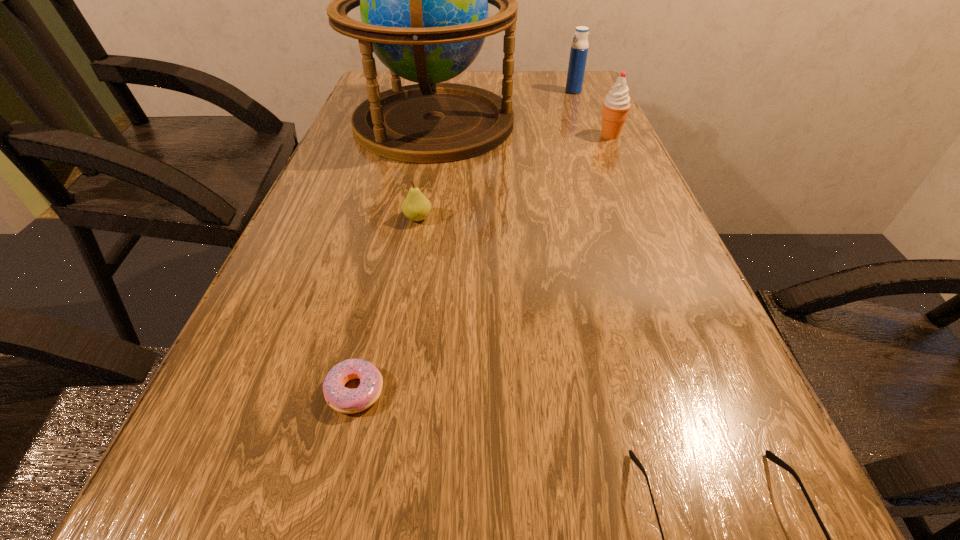
Locate an element on the screen. free spot at the left edge of the desktop is located at coordinates (360, 231).

Find the location of a particular element. The image size is (960, 540). blank space at the right edge is located at coordinates (567, 132).

I want to click on free region at the far right corner of the desktop, so click(546, 77).

You are a GUI agent. You are given a task and a screenshot of the screen. Output one action in this format:
    pyautogui.click(x=<x>, y=<y>)
    Task: Click on the vacant space in between the icecream and the doughnut
    This screenshot has width=960, height=540.
    Given the screenshot: What is the action you would take?
    pyautogui.click(x=483, y=263)

Locate an element on the screen. This screenshot has height=540, width=960. vacant area that lies between the shortest object and the third shortest object is located at coordinates (386, 305).

Identify the location of free space between the icecream and the doughnut. The width and height of the screenshot is (960, 540). (483, 263).

Locate an element on the screen. free space that is in between the pear and the icecream is located at coordinates (514, 177).

Locate which object is the fifth closest to the water bottle. Please provide its 2D coordinates. Your answer should be formatted as a tuple, i.e. [(x, y)], where the tuple contains the x and y coordinates of a point satisfying the conditions above.

[(769, 455)]

Select which object appears as the closest to the water bottle. Please provide its 2D coordinates. Your answer should be formatted as a tuple, i.e. [(x, y)], where the tuple contains the x and y coordinates of a point satisfying the conditions above.

[(423, 0)]

Find the location of `free space that satisfies the following two spatial constraints: 1. on the front side of the icecream; 2. on the right side of the globe`. free space that satisfies the following two spatial constraints: 1. on the front side of the icecream; 2. on the right side of the globe is located at coordinates (431, 136).